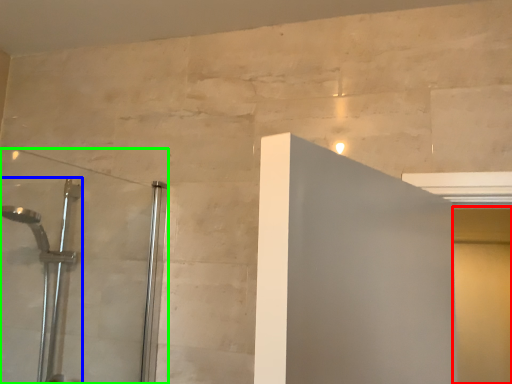
Question: Which object is positioned closest to screen door (highlighted by a red box)? Select from shower (highlighted by a blue box) and shower door (highlighted by a green box).

Choices:
 (A) shower
 (B) shower door

Answer: (B)